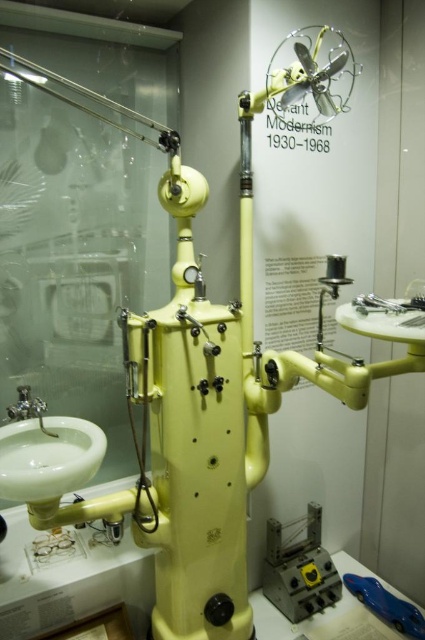
Question: Which object is closer to the camera taking this photo?

Choices:
 (A) brushed metal faucet at lower left
 (B) white glossy sink at lower left
 (C) blue plastic toy car at lower right

Answer: (B)

Question: Does white glossy sink at lower left lie in front of blue plastic toy car at lower right?

Choices:
 (A) yes
 (B) no

Answer: (A)

Question: Is white glossy sink at lower left in front of blue plastic toy car at lower right?

Choices:
 (A) yes
 (B) no

Answer: (A)

Question: Can you confirm if white glossy sink at lower left is positioned above brushed metal faucet at lower left?

Choices:
 (A) yes
 (B) no

Answer: (B)

Question: Which object is positioned closest to the white glossy sink at lower left?

Choices:
 (A) brushed metal faucet at lower left
 (B) blue plastic toy car at lower right

Answer: (A)

Question: Which point appears closest to the camera in this image?

Choices:
 (A) (33, 476)
 (B) (394, 600)

Answer: (A)